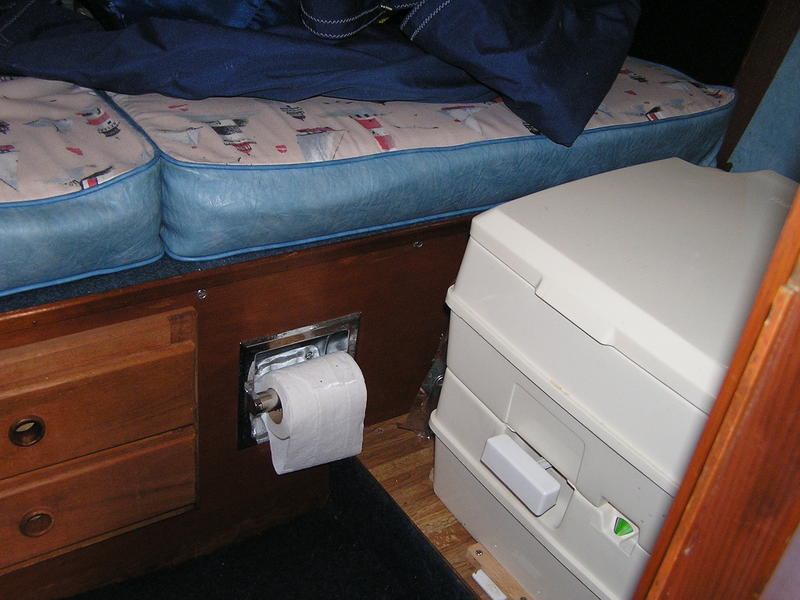
The image size is (800, 600). Find the location of `drawer`. drawer is located at coordinates (60, 423), (86, 509).